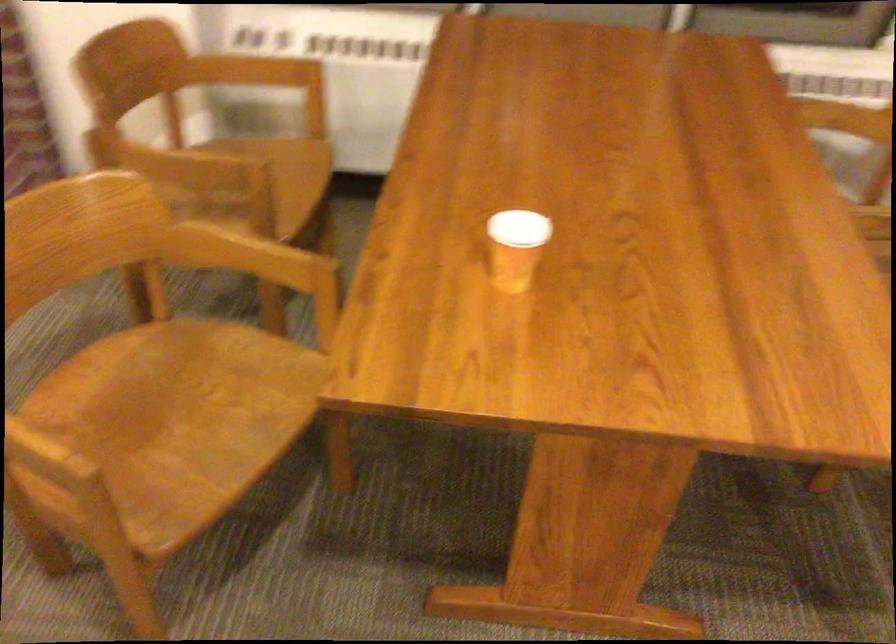
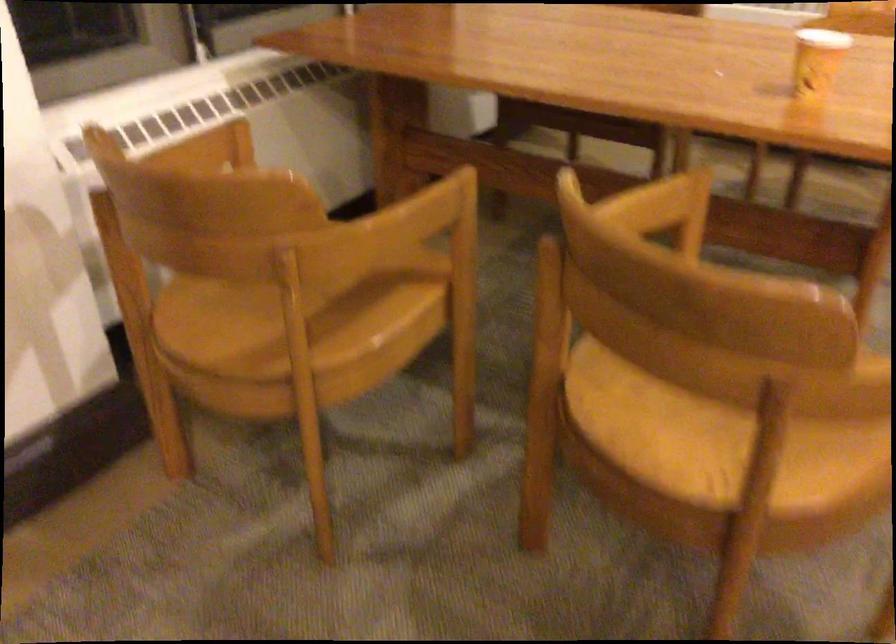
Where in the second image is the point corresponding to point 495,249 from the first image?

(816, 61)